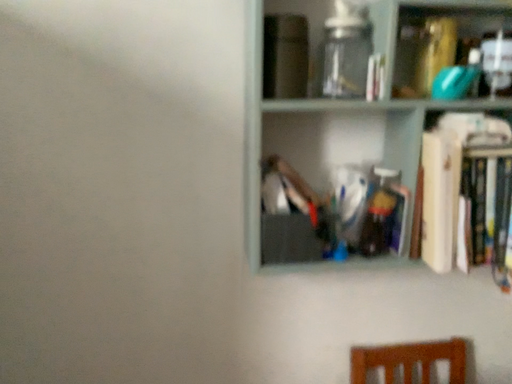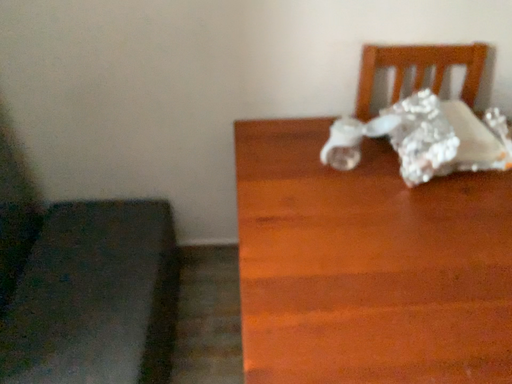
Question: How did the camera likely rotate when shooting the video?

Choices:
 (A) rotated upward
 (B) rotated downward

Answer: (B)